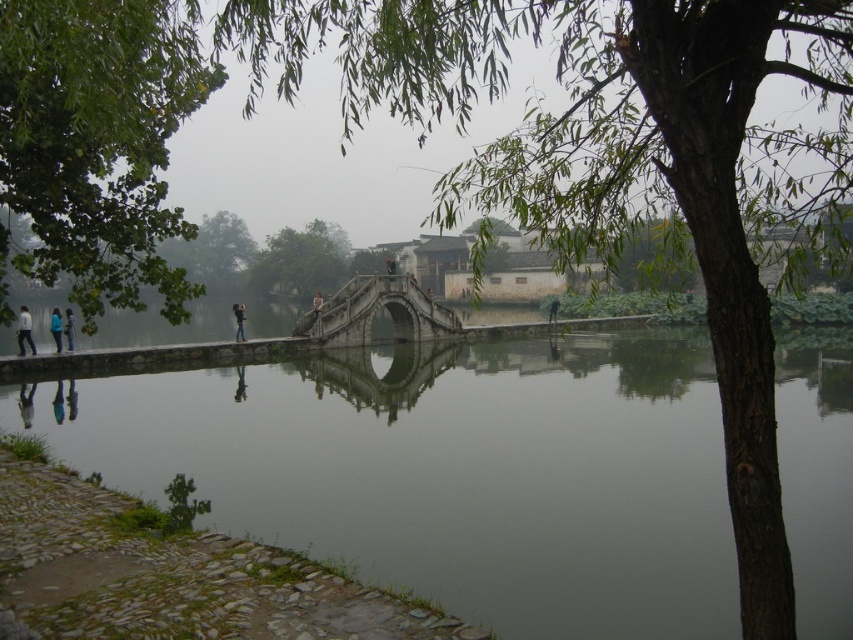
Question: Observing the image, what is the correct spatial positioning of green leafy tree at upper right in reference to blue fabric person at lower left?

Choices:
 (A) left
 (B) right

Answer: (B)

Question: Is green leafy tree at center to the right of blue jeans at left from the viewer's perspective?

Choices:
 (A) yes
 (B) no

Answer: (A)

Question: Is green leafy tree at upper right below green leafy tree at left?

Choices:
 (A) yes
 (B) no

Answer: (B)

Question: Which point appears farthest from the camera in this image?

Choices:
 (A) (318, 301)
 (B) (759, 564)
 (C) (144, 468)
 (D) (83, 45)

Answer: (A)

Question: Which object is the closest to the green reflective water at center?

Choices:
 (A) green leafy tree at center
 (B) blue denim jeans at left
 (C) green leafy tree at left
 (D) light blue jeans at center

Answer: (C)

Question: Which of the following is the closest to the observer?

Choices:
 (A) blue jeans at left
 (B) blue denim jeans at left
 (C) dark blue jeans at center

Answer: (A)